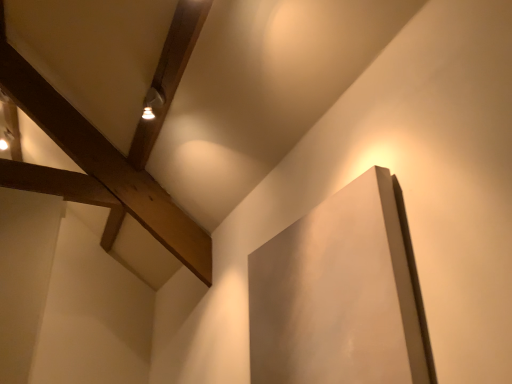
The image size is (512, 384). What do you see at coordinates (338, 293) in the screenshot?
I see `white matte board at upper right` at bounding box center [338, 293].

Where is `white matte board at upper right`? Image resolution: width=512 pixels, height=384 pixels. white matte board at upper right is located at coordinates (338, 293).

This screenshot has width=512, height=384. I want to click on white matte board at upper right, so pos(338,293).